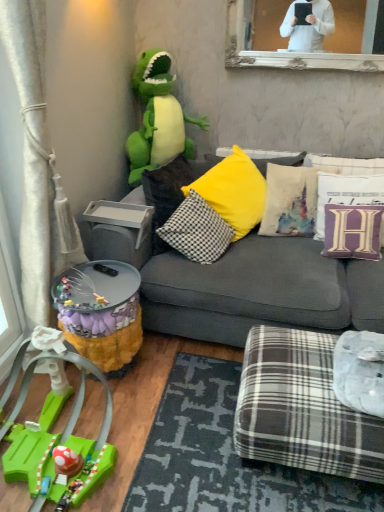
Locate an element on the screen. The image size is (384, 512). vacant point above dark gray textured mat at lower center (from a real-world perspective) is located at coordinates (163, 424).